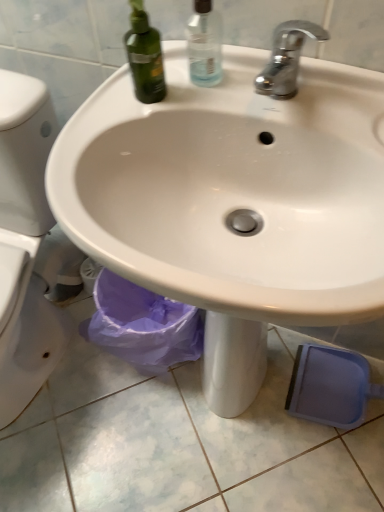
Question: From the image's perspective, relative to chrome metallic faucet at upper center, is white glossy sink at center above or below?

Choices:
 (A) above
 (B) below

Answer: (B)

Question: Is white glossy sink at center bigger or smaller than chrome metallic faucet at upper center?

Choices:
 (A) big
 (B) small

Answer: (A)

Question: Which object is the closest to the transparent plastic spray bottle at upper center?

Choices:
 (A) white glossy sink at center
 (B) chrome metallic faucet at upper center

Answer: (B)

Question: Considering the real-world distances, which object is closest to the transparent plastic spray bottle at upper center?

Choices:
 (A) white glossy sink at center
 (B) chrome metallic faucet at upper center

Answer: (B)